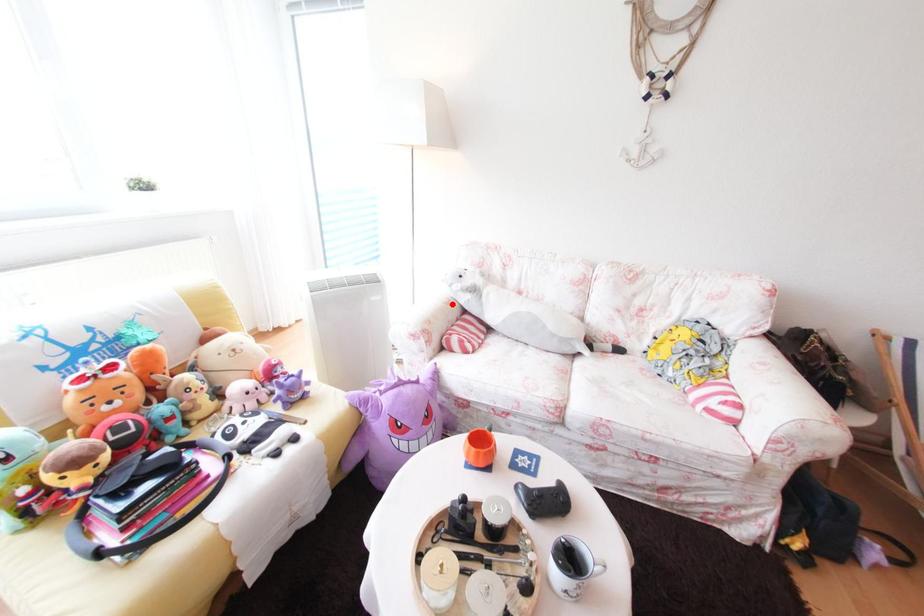
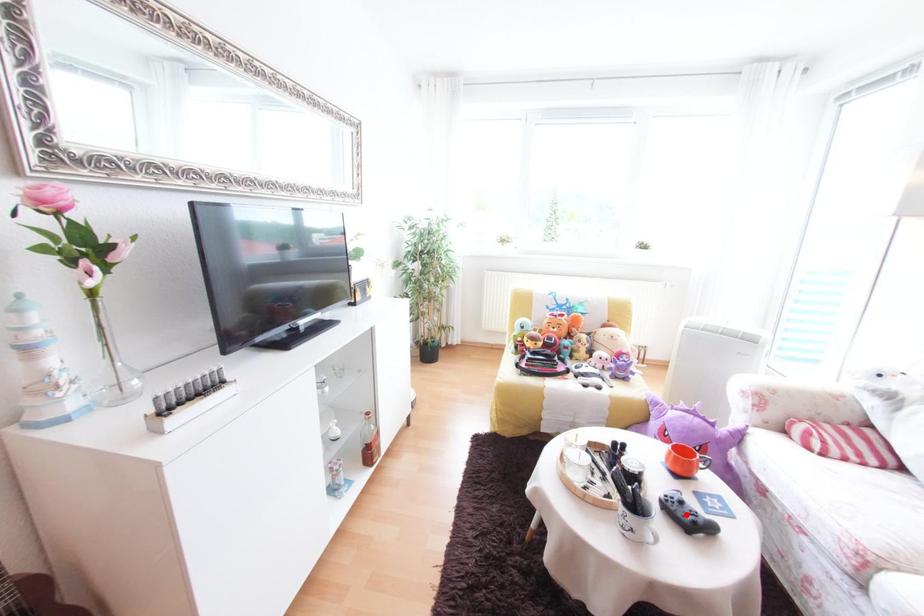
I am providing you with two images of the same scene from different viewpoints. A red point is marked on the first image and another point is marked on the second image. Are the points marked in image1 and image2 representing the same 3D position?

No